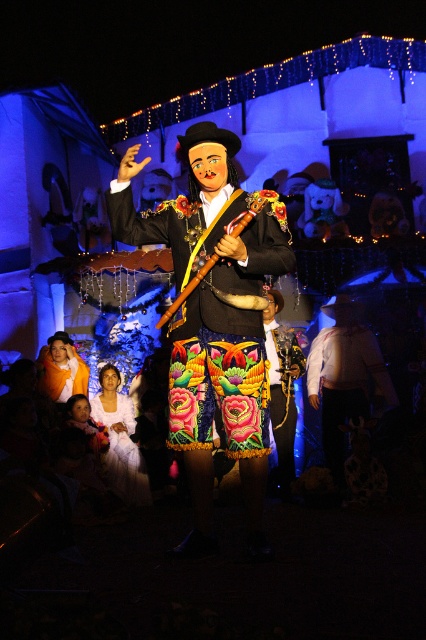
You are standing at the entrance of the festival area and see the matte black mariachi at center. If you want to approach them directly, which direction should you move in relation to your current position?

Since the matte black mariachi at center is located at point coordinates, you should move straight ahead towards the center of the festival area to reach them directly.

You are a photographer at the festival and want to focus your camera on the matte black mariachi at center. However, the wooden flute at center is blocking part of the view. Can you adjust your position to capture the mariachi without the flute in the foreground?

The matte black mariachi at center is closer to the viewer than the wooden flute at center. Since the mariachi is closer, adjusting your position slightly might allow you to angle the camera so the flute moves out of the frame, capturing the mariachi clearly.

Based on the photo, you are an artist trying to sketch the scene. The matte black mariachi at center is positioned exactly at the center of the image. Which object in the scene is located at the exact center?

The matte black mariachi at center is positioned exactly at the center of the image at point coordinates (213, 321).